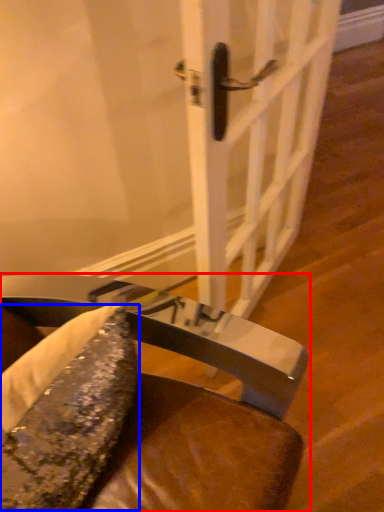
Question: Which object is closer to the camera taking this photo, chair (highlighted by a red box) or food (highlighted by a blue box)?

Choices:
 (A) chair
 (B) food

Answer: (A)